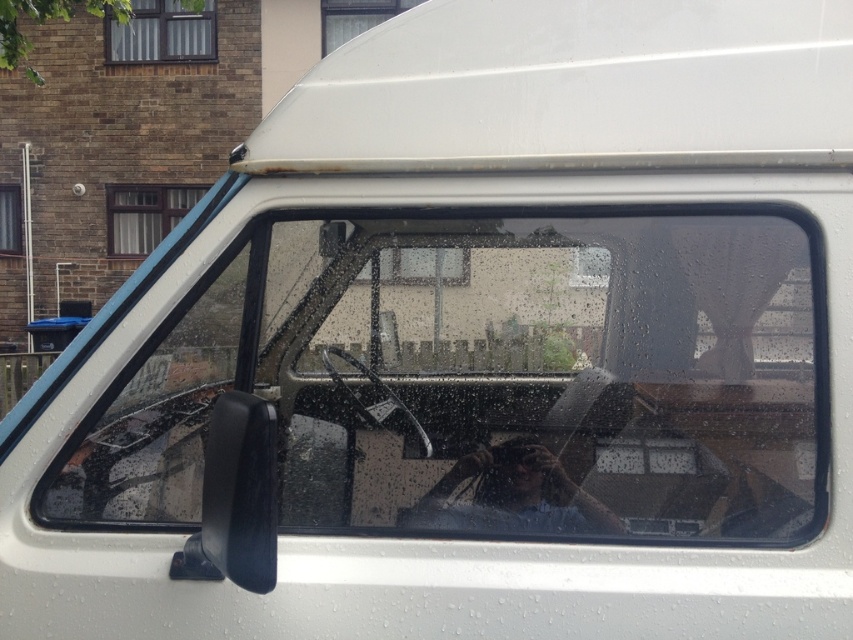
In the scene shown: Between matte glass window at upper left and clear glass window at upper left, which one appears on the right side from the viewer's perspective?

matte glass window at upper left is more to the right.

Which is below, matte glass window at upper left or clear glass window at upper left?

Positioned lower is clear glass window at upper left.

Is point (167, 1) farther from camera compared to point (10, 204)?

No, it is not.

Identify the location of matte glass window at upper left. (161, 33).

Can you confirm if matte glass window at upper left is positioned below white glass window at upper center?

No.

Does matte glass window at upper left have a greater height compared to white glass window at upper center?

No.

Measure the distance between point (x=160, y=38) and camera.

41.38 feet

At what (x,y) coordinates should I click in order to perform the action: click on matte glass window at upper left. Please return your answer as a coordinate pair (x, y). The height and width of the screenshot is (640, 853). Looking at the image, I should click on (161, 33).

Consider the image. Does matte black phone at center have a larger size compared to clear glass window at upper left?

Actually, matte black phone at center might be smaller than clear glass window at upper left.

Locate an element on the screen. This screenshot has width=853, height=640. matte black phone at center is located at coordinates (511, 496).

Is point (479, 508) positioned after point (0, 225)?

No, it is not.

The height and width of the screenshot is (640, 853). Identify the location of matte black phone at center. (511, 496).